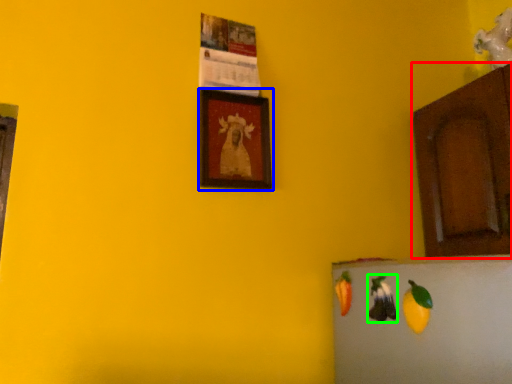
Question: Estimate the real-world distances between objects in this image. Which object is farther from cabinetry (highlighted by a red box), picture frame (highlighted by a blue box) or fruit (highlighted by a green box)?

Choices:
 (A) picture frame
 (B) fruit

Answer: (A)